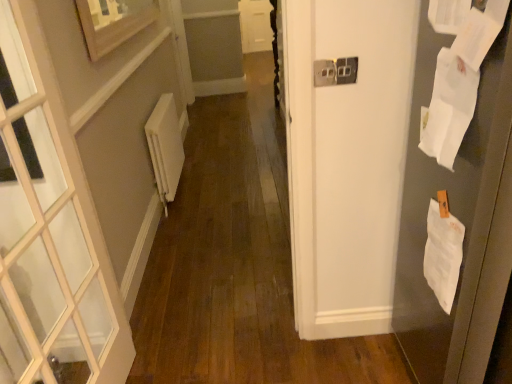
Question: Can you confirm if white plastic electric outlet at upper center is bigger than white matte radiator at left?

Choices:
 (A) yes
 (B) no

Answer: (B)

Question: From a real-world perspective, does white plastic electric outlet at upper center sit lower than white matte radiator at left?

Choices:
 (A) yes
 (B) no

Answer: (B)

Question: Is white plastic electric outlet at upper center to the right of white matte radiator at left from the viewer's perspective?

Choices:
 (A) yes
 (B) no

Answer: (A)

Question: Is white plastic electric outlet at upper center to the left of white matte radiator at left from the viewer's perspective?

Choices:
 (A) yes
 (B) no

Answer: (B)

Question: Considering the relative sizes of white plastic electric outlet at upper center and white matte radiator at left in the image provided, is white plastic electric outlet at upper center shorter than white matte radiator at left?

Choices:
 (A) yes
 (B) no

Answer: (A)

Question: Is white plastic electric outlet at upper center closer to the viewer compared to white matte radiator at left?

Choices:
 (A) yes
 (B) no

Answer: (A)

Question: Is white plastic electric outlet at upper center oriented away from wooden picture frame at upper left?

Choices:
 (A) yes
 (B) no

Answer: (B)

Question: Considering the relative sizes of white plastic electric outlet at upper center and wooden picture frame at upper left in the image provided, is white plastic electric outlet at upper center thinner than wooden picture frame at upper left?

Choices:
 (A) no
 (B) yes

Answer: (B)

Question: Considering the relative sizes of white plastic electric outlet at upper center and wooden picture frame at upper left in the image provided, is white plastic electric outlet at upper center bigger than wooden picture frame at upper left?

Choices:
 (A) yes
 (B) no

Answer: (B)

Question: Considering the relative sizes of white plastic electric outlet at upper center and wooden picture frame at upper left in the image provided, is white plastic electric outlet at upper center shorter than wooden picture frame at upper left?

Choices:
 (A) yes
 (B) no

Answer: (A)

Question: Does white plastic electric outlet at upper center appear on the right side of wooden picture frame at upper left?

Choices:
 (A) no
 (B) yes

Answer: (B)

Question: Is white plastic electric outlet at upper center oriented towards wooden picture frame at upper left?

Choices:
 (A) yes
 (B) no

Answer: (B)

Question: From the image's perspective, is white paper at right under white matte radiator at left?

Choices:
 (A) no
 (B) yes

Answer: (B)